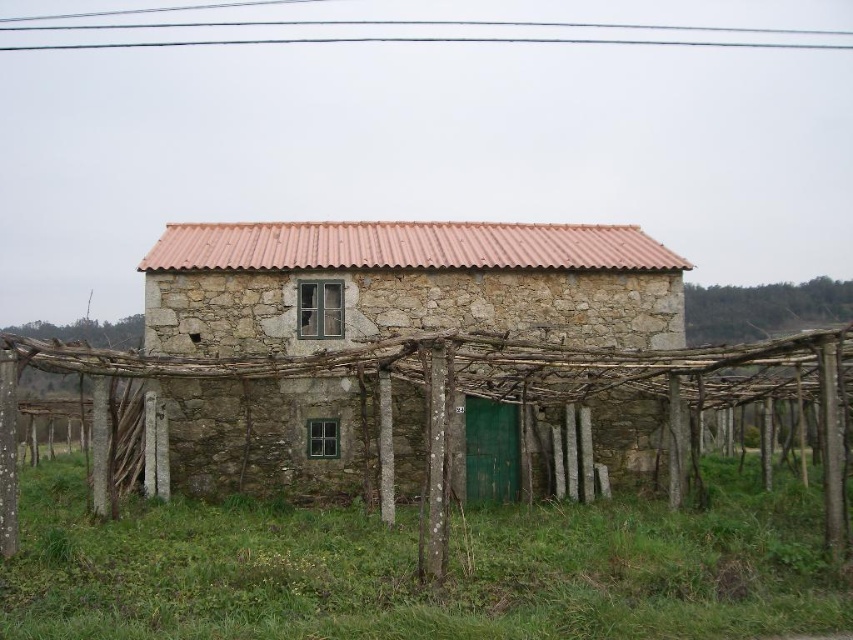
Question: Which point is farther to the camera?

Choices:
 (A) (155, 436)
 (B) (549, 340)

Answer: (B)

Question: Which of the following is the closest to the observer?

Choices:
 (A) (569, 355)
 (B) (334, 435)

Answer: (A)

Question: Does rustic stone barn at center have a larger size compared to brown wooden trellis at center?

Choices:
 (A) yes
 (B) no

Answer: (B)

Question: Can you confirm if rustic stone barn at center is thinner than brown wooden trellis at center?

Choices:
 (A) no
 (B) yes

Answer: (B)

Question: Can you confirm if rustic stone barn at center is thinner than brown wooden trellis at center?

Choices:
 (A) no
 (B) yes

Answer: (B)